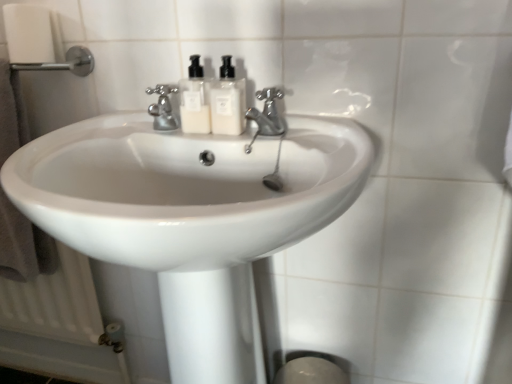
Describe the element at coordinates (162, 107) in the screenshot. The height and width of the screenshot is (384, 512). I see `polished chrome faucet at center, arranged as the first tap when viewed from the left` at that location.

Locate an element on the screen. Image resolution: width=512 pixels, height=384 pixels. polished chrome faucet at center, arranged as the first tap when viewed from the left is located at coordinates pyautogui.click(x=162, y=107).

Image resolution: width=512 pixels, height=384 pixels. Describe the element at coordinates (23, 245) in the screenshot. I see `brown towel at left` at that location.

What is the approximate width of white cardboard toilet paper at upper left?

3.59 inches.

Identify the location of brushed metal towel bar at upper left. This screenshot has height=384, width=512. pyautogui.click(x=64, y=63).

From the image's perspective, which soap dispenser is the 2nd one above the brown towel at left? Please provide its 2D coordinates.

[(194, 100)]

Is white plastic soap dispenser at center, which appears as the first soap dispenser when viewed from the left, bigger or smaller than brown towel at left?

white plastic soap dispenser at center, which appears as the first soap dispenser when viewed from the left, is smaller than brown towel at left.

Can you tell me how much white plastic soap dispenser at center, which is the second soap dispenser in right-to-left order, and brown towel at left differ in facing direction?

The angle between the facing direction of white plastic soap dispenser at center, which is the second soap dispenser in right-to-left order, and the facing direction of brown towel at left is 0.145 degrees.

Would you say white glossy sink at center is outside white plastic soap dispenser at center, which appears as the first soap dispenser when viewed from the left?

white glossy sink at center is positioned outside white plastic soap dispenser at center, which appears as the first soap dispenser when viewed from the left.

In the scene shown: From the image's perspective, is white glossy sink at center located beneath white plastic soap dispenser at center, which appears as the first soap dispenser when viewed from the left?

Yes, from the image's perspective, white glossy sink at center is below white plastic soap dispenser at center, which appears as the first soap dispenser when viewed from the left.

Considering the sizes of objects white glossy sink at center and white plastic soap dispenser at center, which appears as the first soap dispenser when viewed from the left, in the image provided, who is thinner, white glossy sink at center or white plastic soap dispenser at center, which appears as the first soap dispenser when viewed from the left,?

With smaller width is white plastic soap dispenser at center, which appears as the first soap dispenser when viewed from the left.

Does white glossy sink at center lie behind white plastic soap dispenser at center, which appears as the first soap dispenser when viewed from the left?

No, it is in front of white plastic soap dispenser at center, which appears as the first soap dispenser when viewed from the left.

Is white plastic soap dispenser at center, which appears as the first soap dispenser when viewed from the left, at the back of polished chrome faucet at center, arranged as the first tap when viewed from the left?

No, polished chrome faucet at center, arranged as the first tap when viewed from the left, is not facing away from white plastic soap dispenser at center, which appears as the first soap dispenser when viewed from the left.

Measure the distance between polished chrome faucet at center, which is counted as the 2th tap, starting from the right, and white plastic soap dispenser at center, which appears as the first soap dispenser when viewed from the left.

The distance of polished chrome faucet at center, which is counted as the 2th tap, starting from the right, from white plastic soap dispenser at center, which appears as the first soap dispenser when viewed from the left, is 3.54 inches.

Considering the positions of objects polished chrome faucet at center, arranged as the first tap when viewed from the left, and white plastic soap dispenser at center, which is the second soap dispenser in right-to-left order, in the image provided, who is more to the right, polished chrome faucet at center, arranged as the first tap when viewed from the left, or white plastic soap dispenser at center, which is the second soap dispenser in right-to-left order,?

Positioned to the right is white plastic soap dispenser at center, which is the second soap dispenser in right-to-left order.

Is polished chrome faucet at center, which is counted as the 2th tap, starting from the right, not close to white plastic soap dispenser at center, which is the second soap dispenser in right-to-left order?

No.

From the image's perspective, which one is positioned lower, white cardboard toilet paper at upper left or satin nickel faucet at center, which is the 1th tap from right to left?

satin nickel faucet at center, which is the 1th tap from right to left, is shown below in the image.

From the picture: Is satin nickel faucet at center, which is the 1th tap from right to left, surrounded by white cardboard toilet paper at upper left?

Definitely not — satin nickel faucet at center, which is the 1th tap from right to left, is not inside white cardboard toilet paper at upper left.

Is white cardboard toilet paper at upper left facing away from satin nickel faucet at center, which appears as the second tap when viewed from the left?

No, white cardboard toilet paper at upper left is not facing the opposite direction of satin nickel faucet at center, which appears as the second tap when viewed from the left.

From the image's perspective, starting from the white cardboard toilet paper at upper left, which tap is the 2nd one below? Please provide its 2D coordinates.

[(268, 113)]

Could you tell me if polished chrome faucet at center, arranged as the first tap when viewed from the left, is turned towards satin nickel faucet at center, which is the 1th tap from right to left?

No, polished chrome faucet at center, arranged as the first tap when viewed from the left, does not turn towards satin nickel faucet at center, which is the 1th tap from right to left.

Who is smaller, polished chrome faucet at center, which is counted as the 2th tap, starting from the right, or satin nickel faucet at center, which appears as the second tap when viewed from the left?

polished chrome faucet at center, which is counted as the 2th tap, starting from the right, is smaller.

From a real-world perspective, relative to satin nickel faucet at center, which is the 1th tap from right to left, is polished chrome faucet at center, arranged as the first tap when viewed from the left, vertically above or below?

In terms of real-world spatial position, polished chrome faucet at center, arranged as the first tap when viewed from the left, is above satin nickel faucet at center, which is the 1th tap from right to left.

Is polished chrome faucet at center, which is counted as the 2th tap, starting from the right, outside of satin nickel faucet at center, which is the 1th tap from right to left?

A: Yes, polished chrome faucet at center, which is counted as the 2th tap, starting from the right, is not within satin nickel faucet at center, which is the 1th tap from right to left.

Based on the photo, from a real-world perspective, is satin nickel faucet at center, which is the 1th tap from right to left, on white glossy sink at center?

Indeed, from a real-world perspective, satin nickel faucet at center, which is the 1th tap from right to left, stands above white glossy sink at center.

Considering the sizes of objects satin nickel faucet at center, which appears as the second tap when viewed from the left, and white glossy sink at center in the image provided, who is wider, satin nickel faucet at center, which appears as the second tap when viewed from the left, or white glossy sink at center?

Wider between the two is white glossy sink at center.

From the image's perspective, is satin nickel faucet at center, which is the 1th tap from right to left, on top of white glossy sink at center?

Yes.

How far apart are brown towel at left and satin nickel faucet at center, which is the 1th tap from right to left?

They are 23.46 inches apart.

Can you confirm if brown towel at left is wider than satin nickel faucet at center, which is the 1th tap from right to left?

Correct, the width of brown towel at left exceeds that of satin nickel faucet at center, which is the 1th tap from right to left.

Looking at this image, is brown towel at left positioned beyond the bounds of satin nickel faucet at center, which appears as the second tap when viewed from the left?

Yes.

Which of these two, brown towel at left or satin nickel faucet at center, which appears as the second tap when viewed from the left, is bigger?

brown towel at left is bigger.

I want to click on bath towel located underneath the white plastic soap dispenser at center, which appears as the first soap dispenser when viewed from the left (from a real-world perspective), so click(x=23, y=245).

Image resolution: width=512 pixels, height=384 pixels. Identify the location of the 2nd soap dispenser behind the white glossy sink at center. (194, 100).

From the image, which object appears to be nearer to satin nickel faucet at center, which appears as the second tap when viewed from the left, white glossy soap dispenser at center, positioned as the 1th soap dispenser in right-to-left order, or polished chrome faucet at center, which is counted as the 2th tap, starting from the right?

Among the two, white glossy soap dispenser at center, positioned as the 1th soap dispenser in right-to-left order, is located nearer to satin nickel faucet at center, which appears as the second tap when viewed from the left.

From the image, which object appears to be nearer to white glossy soap dispenser at center, which is the second soap dispenser in left-to-right order, white plastic soap dispenser at center, which is the second soap dispenser in right-to-left order, or polished chrome faucet at center, which is counted as the 2th tap, starting from the right?

white plastic soap dispenser at center, which is the second soap dispenser in right-to-left order, is positioned closer to the anchor white glossy soap dispenser at center, which is the second soap dispenser in left-to-right order.

Estimate the real-world distances between objects in this image. Which object is further from polished chrome faucet at center, arranged as the first tap when viewed from the left, white cardboard toilet paper at upper left or brown towel at left?

brown towel at left.

Estimate the real-world distances between objects in this image. Which object is closer to white glossy sink at center, white glossy soap dispenser at center, which is the second soap dispenser in left-to-right order, or satin nickel faucet at center, which appears as the second tap when viewed from the left?

white glossy soap dispenser at center, which is the second soap dispenser in left-to-right order.

Based on their spatial positions, is white cardboard toilet paper at upper left or white glossy soap dispenser at center, which is the second soap dispenser in left-to-right order, further from brown towel at left?

Among the two, white glossy soap dispenser at center, which is the second soap dispenser in left-to-right order, is located further to brown towel at left.

Based on their spatial positions, is white glossy soap dispenser at center, positioned as the 1th soap dispenser in right-to-left order, or polished chrome faucet at center, which is counted as the 2th tap, starting from the right, closer to brown towel at left?

The object closer to brown towel at left is polished chrome faucet at center, which is counted as the 2th tap, starting from the right.

Considering their positions, is white glossy sink at center positioned further to white plastic soap dispenser at center, which appears as the first soap dispenser when viewed from the left, than satin nickel faucet at center, which appears as the second tap when viewed from the left?

white glossy sink at center is further to white plastic soap dispenser at center, which appears as the first soap dispenser when viewed from the left.

Looking at the image, which one is located further to polished chrome faucet at center, which is counted as the 2th tap, starting from the right, white cardboard toilet paper at upper left or brushed metal towel bar at upper left?

The object further to polished chrome faucet at center, which is counted as the 2th tap, starting from the right, is white cardboard toilet paper at upper left.

You are a GUI agent. You are given a task and a screenshot of the screen. Output one action in this format:
    pyautogui.click(x=<x>, y=<y>)
    Task: Click on the tap between polished chrome faucet at center, arranged as the first tap when viewed from the left, and white glossy sink at center from top to bottom
    This screenshot has width=512, height=384.
    Given the screenshot: What is the action you would take?
    pyautogui.click(x=268, y=113)

At what (x,y) coordinates should I click in order to perform the action: click on tap between brown towel at left and white plastic soap dispenser at center, which appears as the first soap dispenser when viewed from the left. Please return your answer as a coordinate pair (x, y). The height and width of the screenshot is (384, 512). Looking at the image, I should click on (162, 107).

You are a GUI agent. You are given a task and a screenshot of the screen. Output one action in this format:
    pyautogui.click(x=<x>, y=<y>)
    Task: Click on the toilet paper between brown towel at left and polished chrome faucet at center, which is counted as the 2th tap, starting from the right, in the horizontal direction
    The width and height of the screenshot is (512, 384).
    Given the screenshot: What is the action you would take?
    pyautogui.click(x=28, y=33)

Locate an element on the screen. shower between white cardboard toilet paper at upper left and white glossy sink at center in the vertical direction is located at coordinates (64, 63).